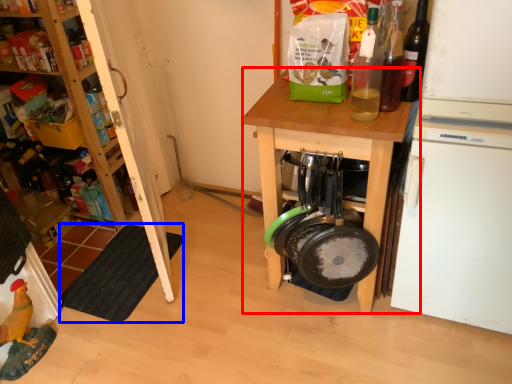
Question: Which object is further to the camera taking this photo, desk (highlighted by a red box) or mat (highlighted by a blue box)?

Choices:
 (A) desk
 (B) mat

Answer: (B)